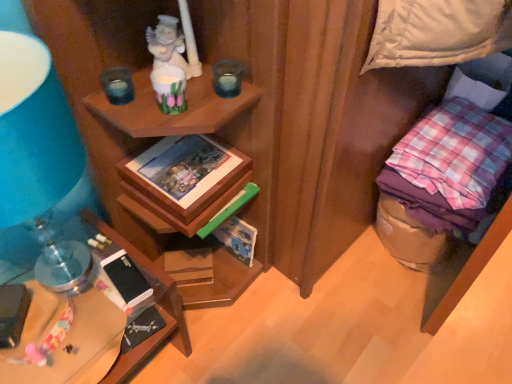
Find the location of a particular element. This screenshot has height=384, width=512. free point to the right of brown cardboard magazine at lower center is located at coordinates 245,295.